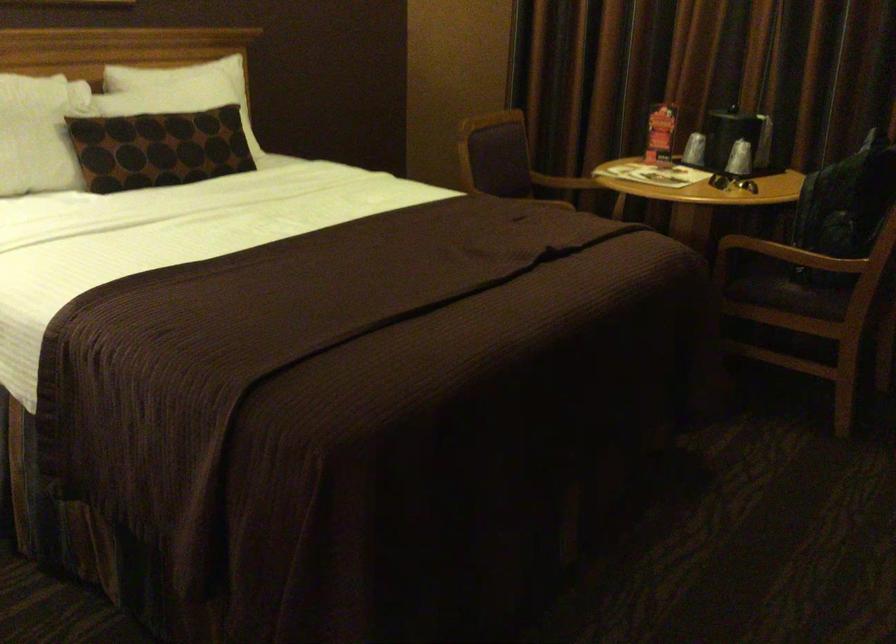
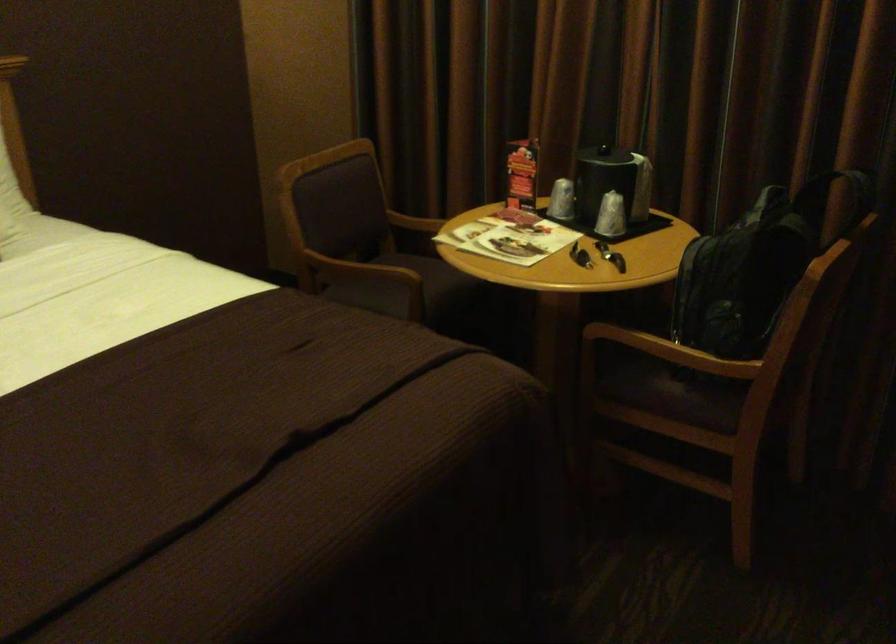
Question: The camera is either moving clockwise (left) or counter-clockwise (right) around the object. The first image is from the beginning of the video and the second image is from the end. Is the camera moving left or right when shooting the video?

Choices:
 (A) Left
 (B) Right

Answer: (A)